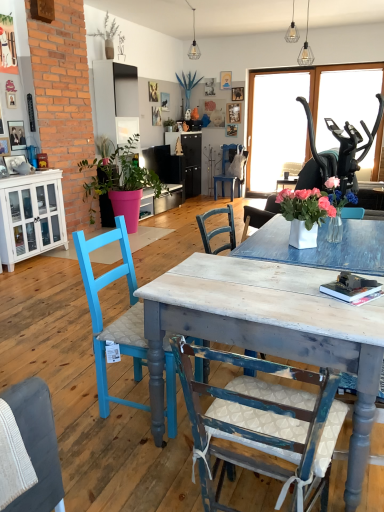
Question: Considering their positions, is green matte plant at upper center, which appears as the 1th houseplant when viewed from the back, located in front of or behind black plastic exercise machine at upper right?

Choices:
 (A) behind
 (B) front

Answer: (A)

Question: From a real-world perspective, is green matte plant at upper center, arranged as the third houseplant when viewed from the front, physically located above or below black plastic exercise machine at upper right?

Choices:
 (A) above
 (B) below

Answer: (A)

Question: Based on their relative distances, which object is nearer to the matte pink pot at left, which ranks as the third houseplant in back-to-front order?

Choices:
 (A) clear glass pendant light at upper center, which is the third lamp from right to left
 (B) distressed wood table at center
 (C) green matte plant at upper center, the third houseplant in the bottom-to-top sequence
 (D) distressed wood chair at center, which is counted as the 1th chair, starting from the bottom
 (E) green matte plant at upper center, the second houseplant from the bottom

Answer: (E)

Question: Estimate the real-world distances between objects in this image. Which object is closer to the woven fabric chair at lower left, marked as the 3th chair in a back-to-front arrangement?

Choices:
 (A) wooden picture frame at upper left
 (B) white glass cabinet at left
 (C) blue painted wood chair at left, the third chair positioned from the front
 (D) matte pink pot at left, marked as the first houseplant in a front-to-back arrangement
 (E) black plastic exercise machine at upper right

Answer: (C)